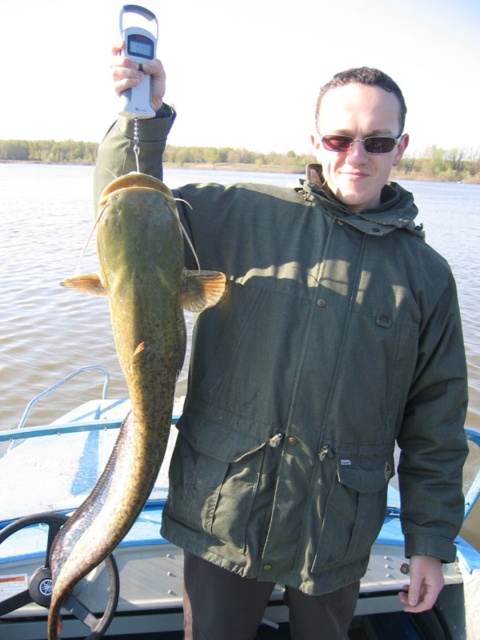
Question: Estimate the real-world distances between objects in this image. Which object is farther from the blue plastic boat at center?

Choices:
 (A) green matte jacket at center
 (B) green scaly fish at left
 (C) sunglasses at center

Answer: (C)

Question: Which of these objects is positioned closest to the sunglasses at center?

Choices:
 (A) blue plastic boat at center
 (B) green scaly fish at left

Answer: (B)

Question: Which point is closer to the camera?

Choices:
 (A) blue plastic boat at center
 (B) green matte jacket at center
 (C) green scaly fish at left
 (D) sunglasses at center

Answer: (B)

Question: Is green scaly fish at left positioned before sunglasses at center?

Choices:
 (A) yes
 (B) no

Answer: (A)

Question: Is blue plastic boat at center closer to the viewer compared to sunglasses at center?

Choices:
 (A) yes
 (B) no

Answer: (B)

Question: Is green scaly fish at left smaller than sunglasses at center?

Choices:
 (A) yes
 (B) no

Answer: (B)